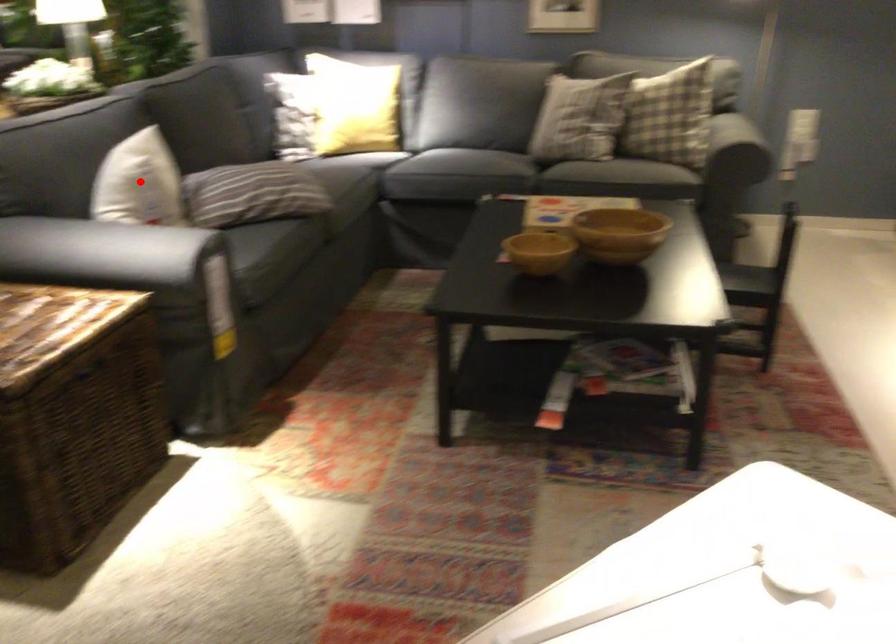
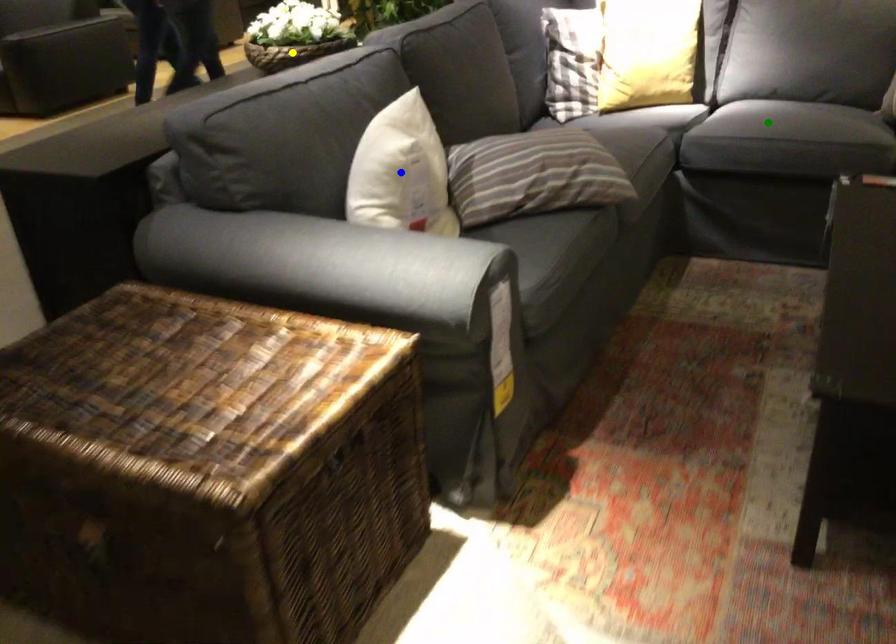
Question: I am providing you with two images of the same scene from different viewpoints. A red point is marked on the first image. You are given multiple points on the second image. Which point in image 2 represents the same 3d spot as the red point in image 1?

Choices:
 (A) yellow point
 (B) blue point
 (C) green point

Answer: (B)